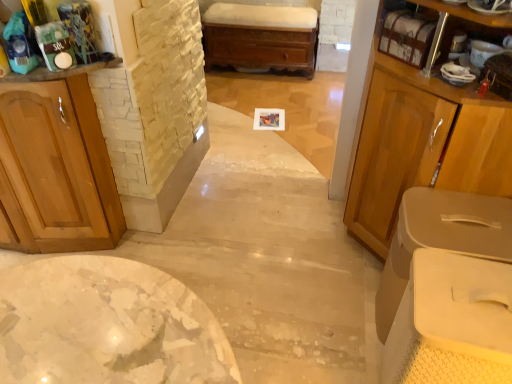
In the scene shown: Measure the distance between point (x=396, y=27) and camera.

They are 4.66 feet apart.

Identify the location of beige plastic bins at right, which is counted as the 1th cabinetry, starting from the right. This screenshot has width=512, height=384. (441, 238).

Describe the element at coordinates (261, 37) in the screenshot. I see `wooden chest at center` at that location.

You are a GUI agent. You are given a task and a screenshot of the screen. Output one action in this format:
    pyautogui.click(x=<x>, y=<y>)
    Task: Click on the wooden cabinet at left, arranged as the third cabinetry when viewed from the right
    
    Given the screenshot: What is the action you would take?
    pyautogui.click(x=55, y=170)

Is wooden cabinet at left, which is the first cabinetry from left to right, positioned behind beige plastic bins at right, the 3th cabinetry positioned from the left?

No.

Which object is positioned more to the right, wooden cabinet at left, arranged as the third cabinetry when viewed from the right, or beige plastic bins at right, which is counted as the 1th cabinetry, starting from the right?

beige plastic bins at right, which is counted as the 1th cabinetry, starting from the right, is more to the right.

Could beige plastic bins at right, the 3th cabinetry positioned from the left, be considered to be inside wooden cabinet at left, which is the first cabinetry from left to right?

→ Actually, beige plastic bins at right, the 3th cabinetry positioned from the left, is outside wooden cabinet at left, which is the first cabinetry from left to right.

Is wooden cabinet at left, which is the first cabinetry from left to right, next to beige plastic bins at right, the 3th cabinetry positioned from the left?

wooden cabinet at left, which is the first cabinetry from left to right, is not next to beige plastic bins at right, the 3th cabinetry positioned from the left, and they're not touching.

Measure the distance between wooden cabinet at left, which is the first cabinetry from left to right, and wooden chest at center.

6.70 feet.

From the image's perspective, relative to wooden chest at center, is wooden cabinet at left, which is the first cabinetry from left to right, above or below?

Based on their image positions, wooden cabinet at left, which is the first cabinetry from left to right, is located beneath wooden chest at center.

In terms of size, does wooden cabinet at left, which is the first cabinetry from left to right, appear bigger or smaller than wooden chest at center?

Considering their sizes, wooden cabinet at left, which is the first cabinetry from left to right, takes up more space than wooden chest at center.

Is the depth of wooden cabinet at left, which is the first cabinetry from left to right, greater than that of wooden chest at center?

That is False.

This screenshot has height=384, width=512. Identify the location of the chest of drawers above the matte wood cabinet at right, positioned as the 2th cabinetry in left-to-right order (from the image's perspective). (261, 37).

Considering their positions, is matte wood cabinet at right, the 2th cabinetry positioned from the right, located in front of or behind wooden chest at center?

matte wood cabinet at right, the 2th cabinetry positioned from the right, is in front of wooden chest at center.

From the image's perspective, is wooden shelf at upper right below wooden cabinet at left, which is the first cabinetry from left to right?

Incorrect, from the image's perspective, wooden shelf at upper right is higher than wooden cabinet at left, which is the first cabinetry from left to right.

Can you confirm if wooden shelf at upper right is taller than wooden cabinet at left, arranged as the third cabinetry when viewed from the right?

No, wooden shelf at upper right is not taller than wooden cabinet at left, arranged as the third cabinetry when viewed from the right.

Is wooden shelf at upper right to the right of wooden cabinet at left, arranged as the third cabinetry when viewed from the right, from the viewer's perspective?

Correct, you'll find wooden shelf at upper right to the right of wooden cabinet at left, arranged as the third cabinetry when viewed from the right.

Based on the photo, from a real-world perspective, is wooden shelf at upper right positioned above or below wooden cabinet at left, arranged as the third cabinetry when viewed from the right?

wooden shelf at upper right is situated higher than wooden cabinet at left, arranged as the third cabinetry when viewed from the right, in the real world.

Which is more to the left, beige plastic bins at right, the 3th cabinetry positioned from the left, or matte wood cabinet at right, positioned as the 2th cabinetry in left-to-right order?

Positioned to the left is matte wood cabinet at right, positioned as the 2th cabinetry in left-to-right order.

Is beige plastic bins at right, the 3th cabinetry positioned from the left, smaller than matte wood cabinet at right, positioned as the 2th cabinetry in left-to-right order?

Yes, beige plastic bins at right, the 3th cabinetry positioned from the left, is smaller than matte wood cabinet at right, positioned as the 2th cabinetry in left-to-right order.

From the image's perspective, which is below, beige plastic bins at right, which is counted as the 1th cabinetry, starting from the right, or matte wood cabinet at right, the 2th cabinetry positioned from the right?

beige plastic bins at right, which is counted as the 1th cabinetry, starting from the right, from the image's perspective.

Are beige plastic bins at right, the 3th cabinetry positioned from the left, and matte wood cabinet at right, the 2th cabinetry positioned from the right, located far from each other?

No, there isn't a large distance between beige plastic bins at right, the 3th cabinetry positioned from the left, and matte wood cabinet at right, the 2th cabinetry positioned from the right.

From a real-world perspective, is wooden shelf at upper right positioned above or below beige plastic bins at right, the 3th cabinetry positioned from the left?

wooden shelf at upper right is situated higher than beige plastic bins at right, the 3th cabinetry positioned from the left, in the real world.

Based on the photo, is wooden shelf at upper right far from beige plastic bins at right, which is counted as the 1th cabinetry, starting from the right?

wooden shelf at upper right is actually quite close to beige plastic bins at right, which is counted as the 1th cabinetry, starting from the right.

Between wooden shelf at upper right and beige plastic bins at right, the 3th cabinetry positioned from the left, which one appears on the right side from the viewer's perspective?

beige plastic bins at right, the 3th cabinetry positioned from the left, is more to the right.

Considering the relative sizes of beige plastic bins at right, the 3th cabinetry positioned from the left, and wooden cabinet at left, which is the first cabinetry from left to right, in the image provided, is beige plastic bins at right, the 3th cabinetry positioned from the left, shorter than wooden cabinet at left, which is the first cabinetry from left to right,?

Yes.

From the image's perspective, which one is positioned higher, beige plastic bins at right, which is counted as the 1th cabinetry, starting from the right, or wooden cabinet at left, which is the first cabinetry from left to right?

wooden cabinet at left, which is the first cabinetry from left to right, appears higher in the image.

Considering the relative sizes of beige plastic bins at right, which is counted as the 1th cabinetry, starting from the right, and wooden cabinet at left, which is the first cabinetry from left to right, in the image provided, is beige plastic bins at right, which is counted as the 1th cabinetry, starting from the right, smaller than wooden cabinet at left, which is the first cabinetry from left to right,?

Yes.

Based on the photo, how many degrees apart are the facing directions of beige plastic bins at right, the 3th cabinetry positioned from the left, and wooden cabinet at left, which is the first cabinetry from left to right?

92.7 degrees separate the facing orientations of beige plastic bins at right, the 3th cabinetry positioned from the left, and wooden cabinet at left, which is the first cabinetry from left to right.

Locate an element on the screen. the 2nd cabinetry to the right of the wooden cabinet at left, arranged as the third cabinetry when viewed from the right, counting from the anchor's position is located at coordinates (441, 238).

The width and height of the screenshot is (512, 384). Identify the location of chest of drawers behind the wooden cabinet at left, arranged as the third cabinetry when viewed from the right. (261, 37).

Which object lies further to the anchor point wooden cabinet at left, which is the first cabinetry from left to right, beige plastic bins at right, the 3th cabinetry positioned from the left, or wooden shelf at upper right?

beige plastic bins at right, the 3th cabinetry positioned from the left.

Estimate the real-world distances between objects in this image. Which object is closer to matte wood cabinet at right, the 2th cabinetry positioned from the right, wooden cabinet at left, which is the first cabinetry from left to right, or wooden chest at center?

wooden cabinet at left, which is the first cabinetry from left to right, lies closer to matte wood cabinet at right, the 2th cabinetry positioned from the right, than the other object.

From the image, which object appears to be nearer to wooden shelf at upper right, matte wood cabinet at right, the 2th cabinetry positioned from the right, or beige plastic bins at right, the 3th cabinetry positioned from the left?

matte wood cabinet at right, the 2th cabinetry positioned from the right, lies closer to wooden shelf at upper right than the other object.

Looking at the image, which one is located further to wooden cabinet at left, which is the first cabinetry from left to right, wooden shelf at upper right or beige plastic bins at right, the 3th cabinetry positioned from the left?

Among the two, beige plastic bins at right, the 3th cabinetry positioned from the left, is located further to wooden cabinet at left, which is the first cabinetry from left to right.

Considering their positions, is wooden cabinet at left, which is the first cabinetry from left to right, positioned closer to wooden chest at center than wooden shelf at upper right?

wooden shelf at upper right is positioned closer to the anchor wooden chest at center.

From the image, which object appears to be farther from matte wood cabinet at right, positioned as the 2th cabinetry in left-to-right order, wooden chest at center or beige plastic bins at right, which is counted as the 1th cabinetry, starting from the right?

wooden chest at center is further to matte wood cabinet at right, positioned as the 2th cabinetry in left-to-right order.

From the image, which object appears to be farther from wooden shelf at upper right, wooden cabinet at left, arranged as the third cabinetry when viewed from the right, or beige plastic bins at right, which is counted as the 1th cabinetry, starting from the right?

The object further to wooden shelf at upper right is wooden cabinet at left, arranged as the third cabinetry when viewed from the right.

From the image, which object appears to be nearer to wooden shelf at upper right, matte wood cabinet at right, the 2th cabinetry positioned from the right, or wooden chest at center?

matte wood cabinet at right, the 2th cabinetry positioned from the right, lies closer to wooden shelf at upper right than the other object.

Find the location of a particular element. Image resolution: width=512 pixels, height=384 pixels. cabinetry located between wooden cabinet at left, which is the first cabinetry from left to right, and beige plastic bins at right, the 3th cabinetry positioned from the left, in the left-right direction is located at coordinates (425, 127).

Locate an element on the screen. shelf between wooden cabinet at left, which is the first cabinetry from left to right, and matte wood cabinet at right, the 2th cabinetry positioned from the right, from left to right is located at coordinates (406, 36).

Where is `shelf between wooden cabinet at left, arranged as the third cabinetry when viewed from the right, and beige plastic bins at right, which is counted as the 1th cabinetry, starting from the right`? The width and height of the screenshot is (512, 384). shelf between wooden cabinet at left, arranged as the third cabinetry when viewed from the right, and beige plastic bins at right, which is counted as the 1th cabinetry, starting from the right is located at coordinates (406, 36).

At what (x,y) coordinates should I click in order to perform the action: click on shelf between matte wood cabinet at right, the 2th cabinetry positioned from the right, and wooden chest at center, along the z-axis. Please return your answer as a coordinate pair (x, y). The height and width of the screenshot is (384, 512). Looking at the image, I should click on (406, 36).